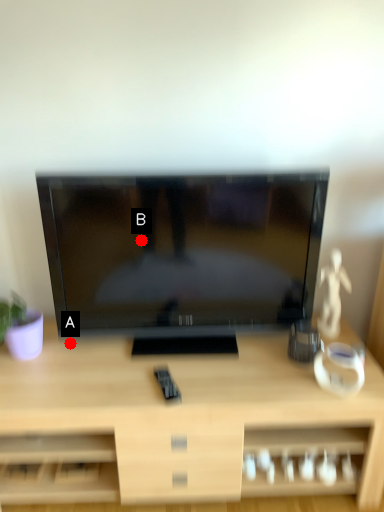
Question: Two points are circled on the image, labeled by A and B beside each circle. Among these points, which one is nearest to the camera?

Choices:
 (A) A is closer
 (B) B is closer

Answer: (B)